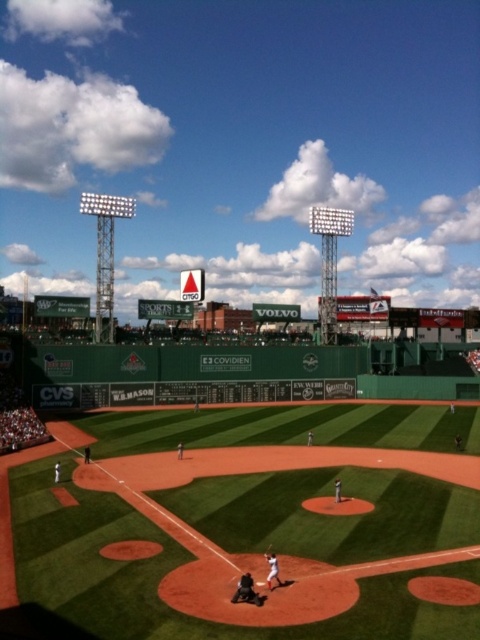
Question: Can you confirm if green turf field at center is thinner than wooden bat at home plate?

Choices:
 (A) no
 (B) yes

Answer: (A)

Question: Which point is farther to the camera?

Choices:
 (A) dark gray fabric catcher at lower center
 (B) white uniform bat at center
 (C) green turf field at center

Answer: (B)

Question: Which object is positioned farthest from the dark gray fabric catcher at lower center?

Choices:
 (A) wooden bat at home plate
 (B) white uniform bat at center
 (C) green turf field at center

Answer: (C)

Question: Which point appears closest to the camera in this image?

Choices:
 (A) (252, 584)
 (B) (335, 465)

Answer: (A)

Question: Is green turf field at center thinner than white uniform bat at center?

Choices:
 (A) yes
 (B) no

Answer: (B)

Question: Does white uniform bat at center appear on the left side of wooden bat at home plate?

Choices:
 (A) no
 (B) yes

Answer: (A)